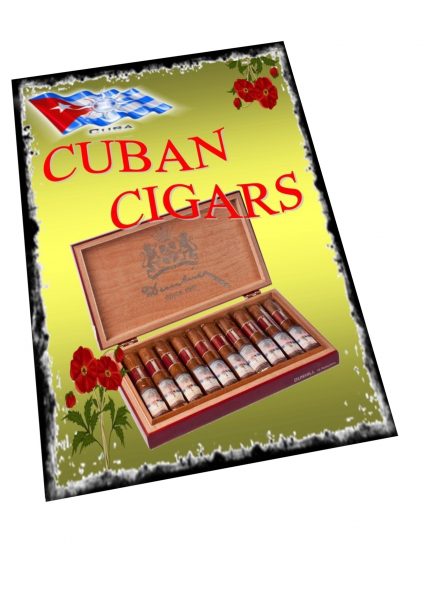
Locate an element on the screen. cigar box is located at coordinates (166, 290).